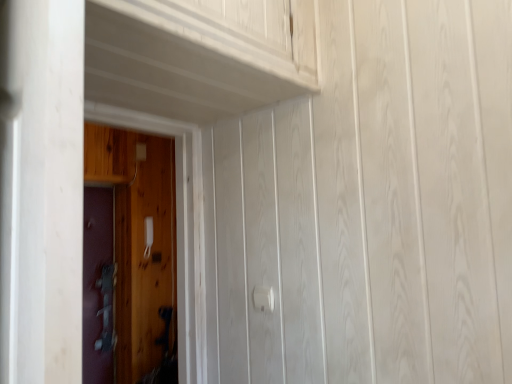
Question: From the image's perspective, is white plastic door handle at center on top of metallic gray door at left, which is counted as the 2th door, starting from the front?

Choices:
 (A) yes
 (B) no

Answer: (A)

Question: Is white plastic door handle at center closer to camera compared to metallic gray door at left, acting as the 1th door starting from the back?

Choices:
 (A) yes
 (B) no

Answer: (A)

Question: Could you tell me if white plastic door handle at center is facing metallic gray door at left, the 2th door positioned from the right?

Choices:
 (A) no
 (B) yes

Answer: (A)

Question: Can you confirm if white plastic door handle at center is wider than metallic gray door at left, which is counted as the 2th door, starting from the front?

Choices:
 (A) yes
 (B) no

Answer: (B)

Question: Is white plastic door handle at center far from metallic gray door at left, the 2th door positioned from the right?

Choices:
 (A) no
 (B) yes

Answer: (B)

Question: Does white plastic door handle at center have a smaller size compared to metallic gray door at left, the first door viewed from the left?

Choices:
 (A) yes
 (B) no

Answer: (A)

Question: Considering the relative positions of white plastic door handle at center and wooden door at left, which is counted as the first door, starting from the front, in the image provided, is white plastic door handle at center to the left of wooden door at left, which is counted as the first door, starting from the front, from the viewer's perspective?

Choices:
 (A) no
 (B) yes

Answer: (A)

Question: Is white plastic door handle at center not close to wooden door at left, the 2th door in the left-to-right sequence?

Choices:
 (A) yes
 (B) no

Answer: (A)

Question: From a real-world perspective, is white plastic door handle at center located beneath wooden door at left, marked as the second door in a back-to-front arrangement?

Choices:
 (A) yes
 (B) no

Answer: (A)

Question: Is white plastic door handle at center positioned before wooden door at left, the 1th door viewed from the right?

Choices:
 (A) yes
 (B) no

Answer: (B)

Question: Does white plastic door handle at center have a greater height compared to wooden door at left, the 2th door in the left-to-right sequence?

Choices:
 (A) no
 (B) yes

Answer: (A)

Question: Considering the relative sizes of white plastic door handle at center and wooden door at left, the 1th door viewed from the right, in the image provided, is white plastic door handle at center smaller than wooden door at left, the 1th door viewed from the right,?

Choices:
 (A) no
 (B) yes

Answer: (B)

Question: From a real-world perspective, is wooden door at left, marked as the second door in a back-to-front arrangement, physically above metallic gray door at left, the first door viewed from the left?

Choices:
 (A) no
 (B) yes

Answer: (B)